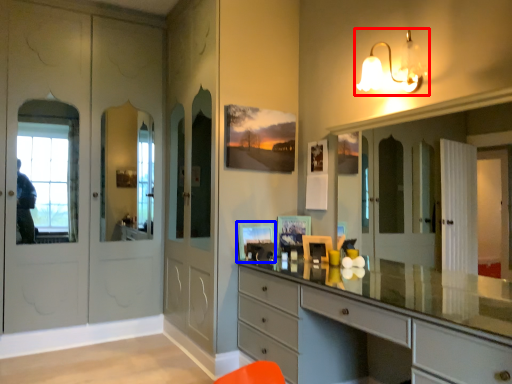
Question: Which object appears closest to the camera in this image, light fixture (highlighted by a red box) or picture frame (highlighted by a blue box)?

Choices:
 (A) light fixture
 (B) picture frame

Answer: (A)